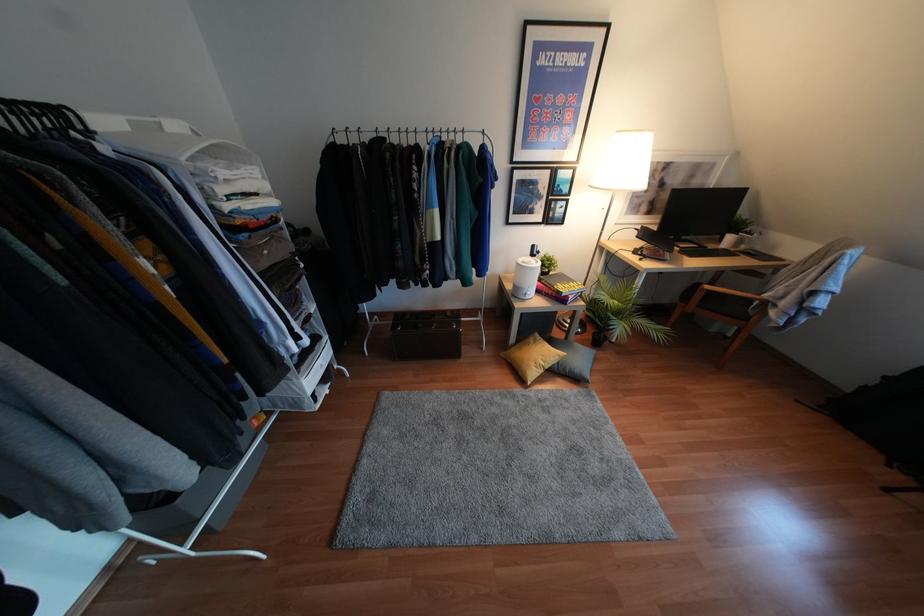
This screenshot has height=616, width=924. I want to click on chair sitting surface, so click(734, 312).